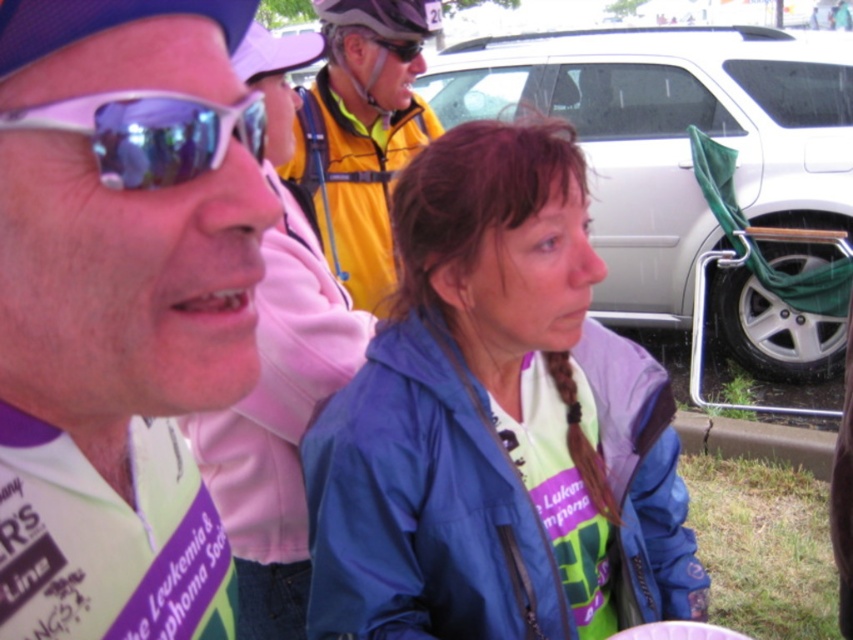
You are at a public event and see the yellow jacket at upper center and the shiny black helmet at upper center. Which object takes up more space in the image?

The yellow jacket at upper center is larger in size than the shiny black helmet at upper center, so it takes up more space in the image.

You are a photographer at the event and want to capture both the shiny purple plastic sunglasses at upper left and the sunglasses at center in a single shot. Which pair of sunglasses will appear larger in the photo?

The shiny purple plastic sunglasses at upper left will appear larger in the photo because they have a greater height compared to the sunglasses at center.

You are at an outdoor event and notice two items in the upper center area of your view. You see the yellow jacket at upper center and the shiny black helmet at upper center. Which item is closer to you?

The yellow jacket at upper center is closer to the viewer than the shiny black helmet at upper center.